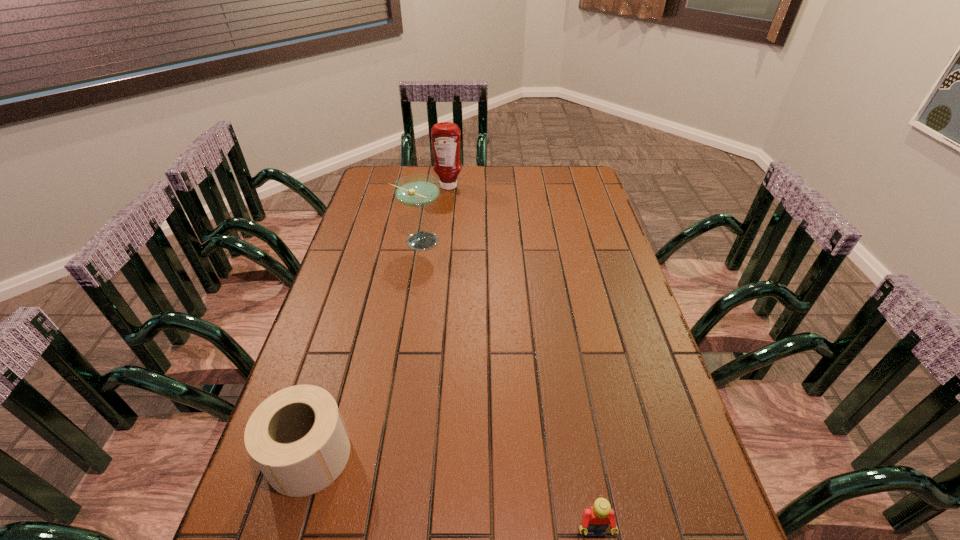
Image resolution: width=960 pixels, height=540 pixels. In the image, there is a desktop. In order to click on free space at the left edge in this screenshot , I will do `click(384, 208)`.

Locate an element on the screen. The width and height of the screenshot is (960, 540). vacant region at the right edge of the desktop is located at coordinates (619, 329).

The height and width of the screenshot is (540, 960). What are the coordinates of `vacant space that's between the toilet tissue and the second farthest object` in the screenshot? It's located at (364, 348).

I want to click on free space between the condiment and the martini, so click(x=434, y=214).

In order to click on free spot between the condiment and the martini in this screenshot , I will do `click(434, 214)`.

At what (x,y) coordinates should I click in order to perform the action: click on free spot between the second nearest object and the farthest object. Please return your answer as a coordinate pair (x, y). Image resolution: width=960 pixels, height=540 pixels. Looking at the image, I should click on (379, 321).

The width and height of the screenshot is (960, 540). What are the coordinates of `unoccupied area between the condiment and the martini` in the screenshot? It's located at (434, 214).

Identify the location of object that can be found as the third closest to the third farthest object. This screenshot has height=540, width=960. (445, 136).

Locate an element on the screen. The height and width of the screenshot is (540, 960). object that is the second closest to the martini is located at coordinates (297, 438).

Locate an element on the screen. This screenshot has width=960, height=540. free point that satisfies the following two spatial constraints: 1. on the back side of the martini; 2. on the right side of the farthest object is located at coordinates (428, 186).